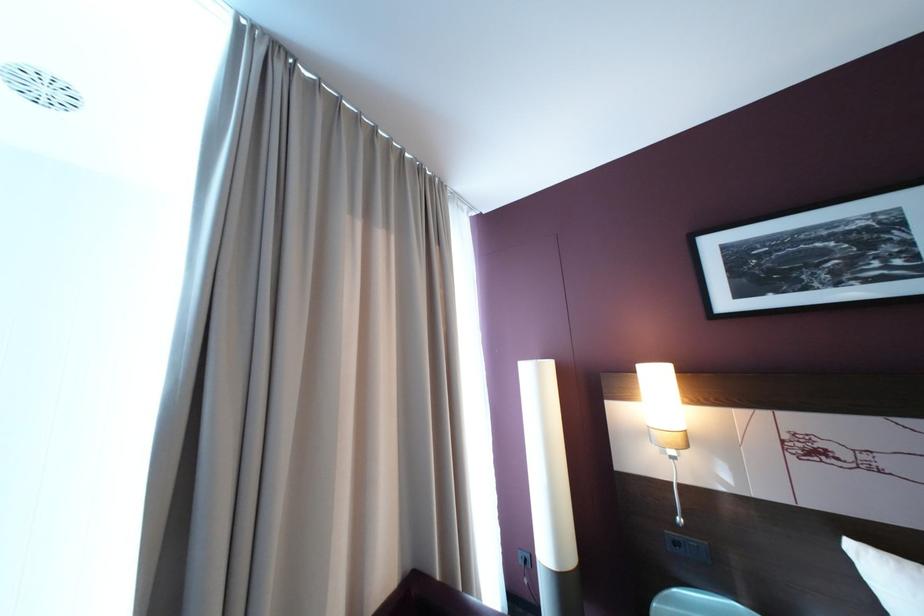
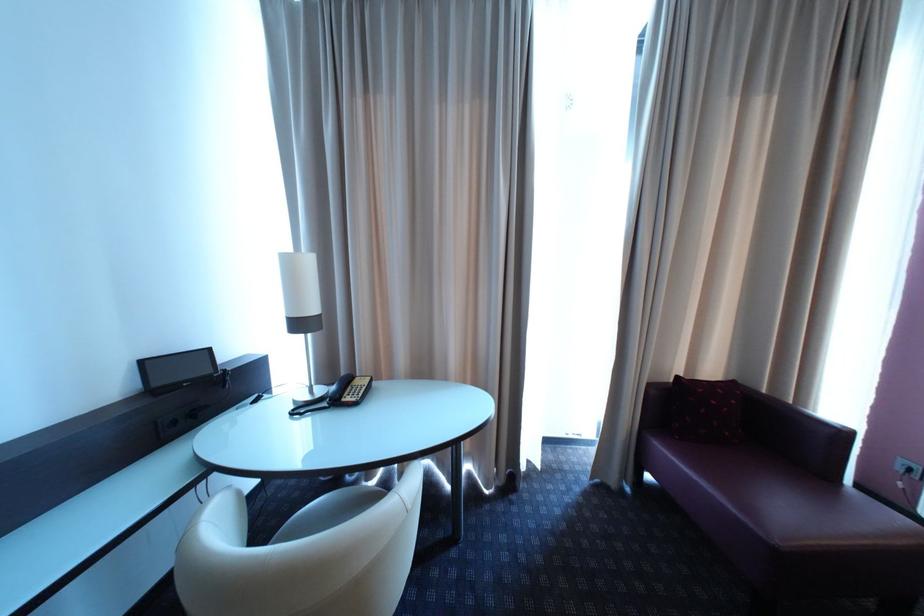
Looking at this image, the images are taken continuously from a first-person perspective. In which direction is your viewpoint rotating?

The camera rotated toward left-down.